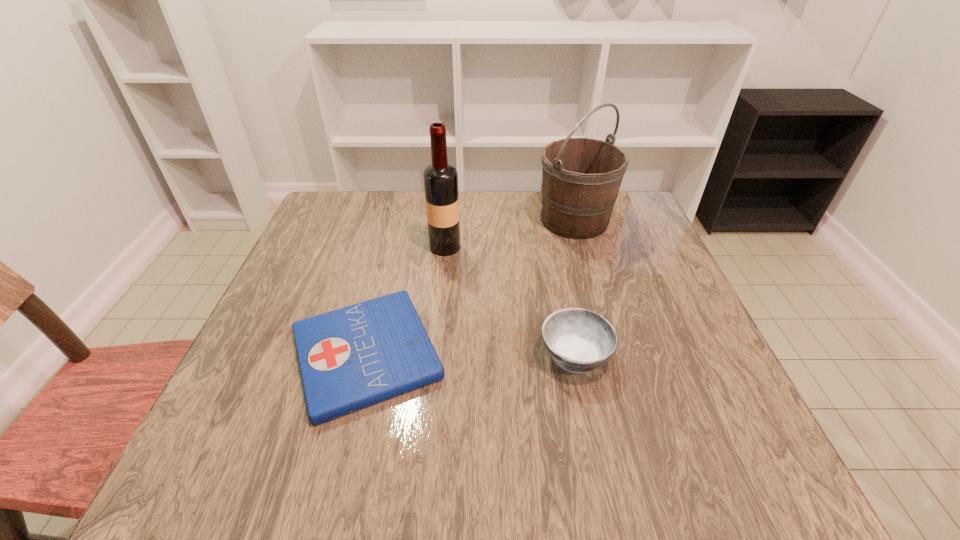
This screenshot has height=540, width=960. Find the location of `bucket`. bucket is located at coordinates (581, 177).

You are a GUI agent. You are given a task and a screenshot of the screen. Output one action in this format:
    pyautogui.click(x=<x>, y=<y>)
    Task: Click on the wine bottle
    Image resolution: width=960 pixels, height=540 pixels.
    Given the screenshot: What is the action you would take?
    pyautogui.click(x=440, y=178)

I want to click on the third tallest object, so click(579, 340).

The image size is (960, 540). In order to click on the first-aid kit in this screenshot , I will do `click(350, 358)`.

Locate an element on the screen. This screenshot has height=540, width=960. vacant space located on the left of the bucket is located at coordinates (422, 220).

Identify the location of vacant point located 0.320m on the right of the wine bottle. Image resolution: width=960 pixels, height=540 pixels. (587, 247).

Where is `vacant space situated on the left of the ashtray`? The image size is (960, 540). vacant space situated on the left of the ashtray is located at coordinates (399, 355).

I want to click on free spot located 0.210m on the back of the shortest object, so click(x=394, y=242).

In order to click on bucket situated at the far edge in this screenshot , I will do `click(581, 177)`.

The height and width of the screenshot is (540, 960). What are the coordinates of `wine bottle present at the far edge` in the screenshot? It's located at (440, 178).